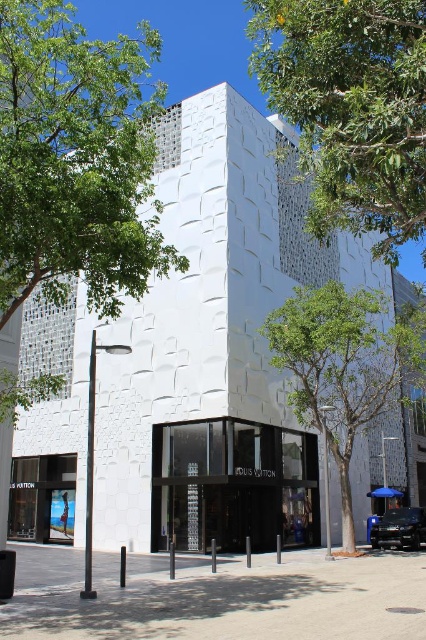
Question: Which object appears closest to the camera in this image?

Choices:
 (A) green leafy tree at center
 (B) green leafy tree at upper right
 (C) green leafy tree at upper left

Answer: (B)

Question: Does white textured building at center come in front of green leafy tree at upper right?

Choices:
 (A) yes
 (B) no

Answer: (B)

Question: Which point appears closest to the camera in this image?

Choices:
 (A) (301, 323)
 (B) (353, 88)
 (C) (100, 74)

Answer: (B)

Question: Does white textured building at center appear over green leafy tree at center?

Choices:
 (A) no
 (B) yes

Answer: (A)

Question: Considering the relative positions of white textured building at center and green leafy tree at upper right in the image provided, where is white textured building at center located with respect to green leafy tree at upper right?

Choices:
 (A) right
 (B) left

Answer: (A)

Question: Considering the real-world distances, which object is closest to the green leafy tree at upper right?

Choices:
 (A) green leafy tree at upper left
 (B) white textured building at center
 (C) green leafy tree at center

Answer: (A)